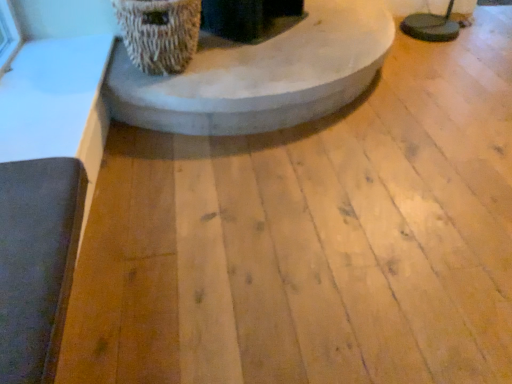
Where is `vacant area that is in front of white concrete fireplace at upper center`? This screenshot has width=512, height=384. vacant area that is in front of white concrete fireplace at upper center is located at coordinates (287, 245).